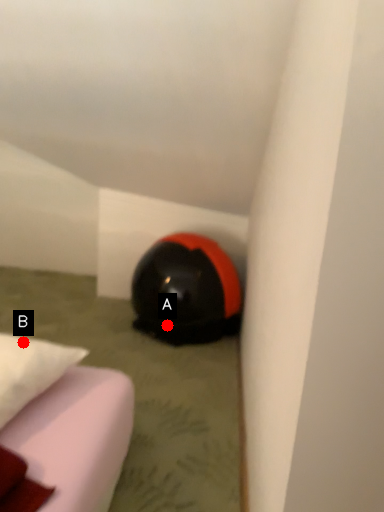
Question: Two points are circled on the image, labeled by A and B beside each circle. Which point is further to the camera?

Choices:
 (A) A is further
 (B) B is further

Answer: (A)